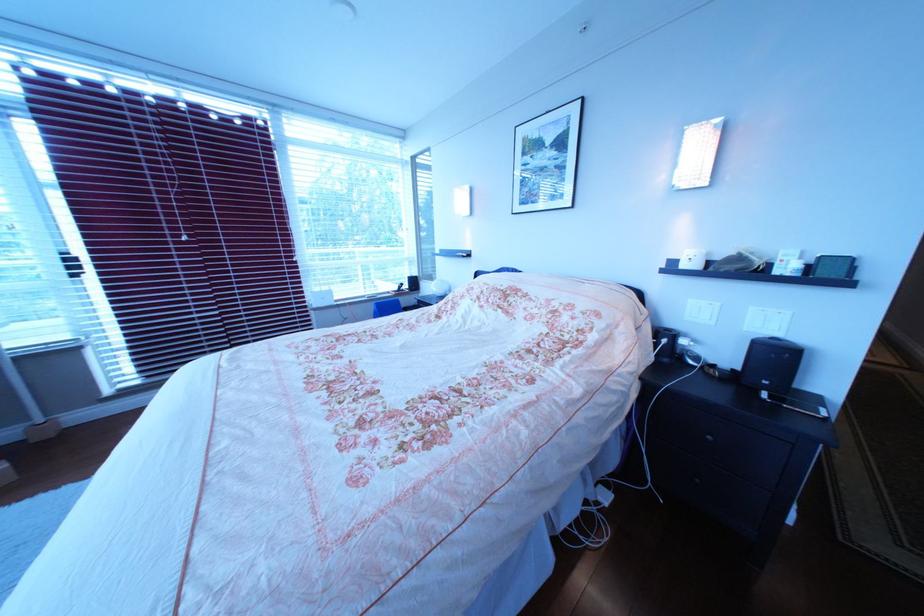
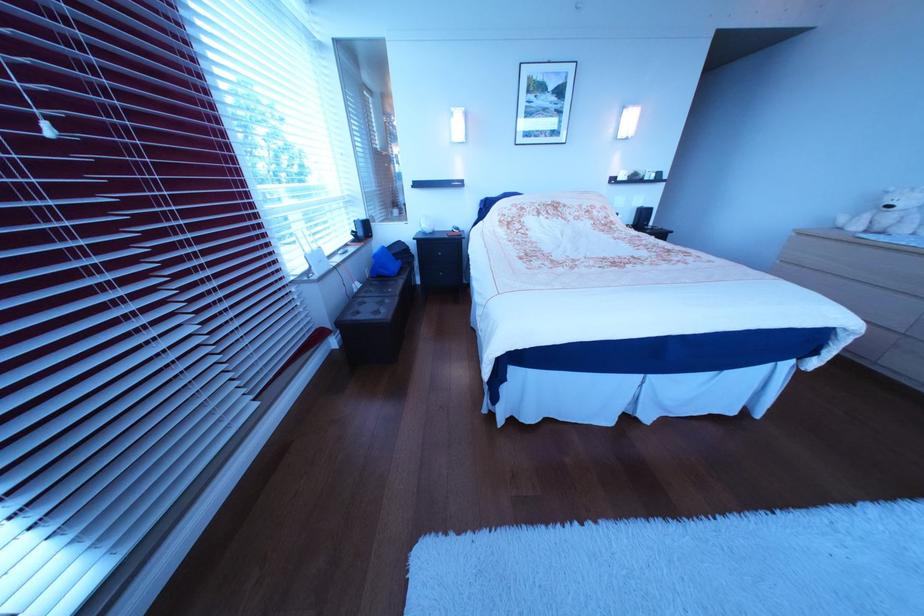
Locate, in the second image, the point that corresponds to point (202, 236) in the first image.

(63, 120)